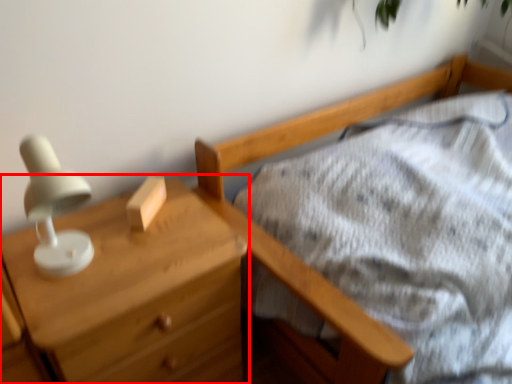
Question: From the image's perspective, where is chest of drawers (annotated by the red box) located in relation to block in the image?

Choices:
 (A) above
 (B) below

Answer: (B)